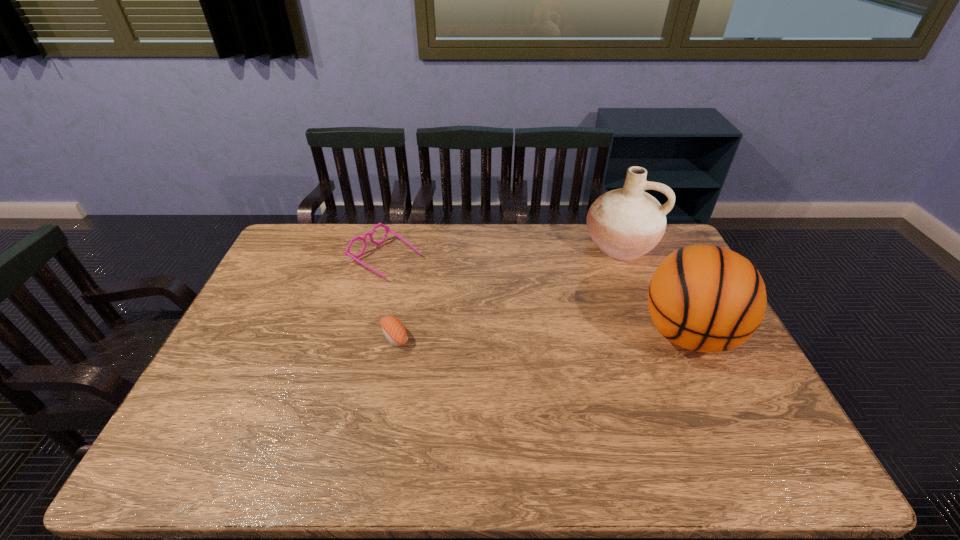
This screenshot has height=540, width=960. I want to click on vacant space on the desktop that is between the shortest object and the basketball and is positioned to pour from the handle of the pottery, so click(x=584, y=335).

Identify the location of free space on the desktop that is between the sushi and the basketball and is positioned on the arms of the spectacles. (516, 335).